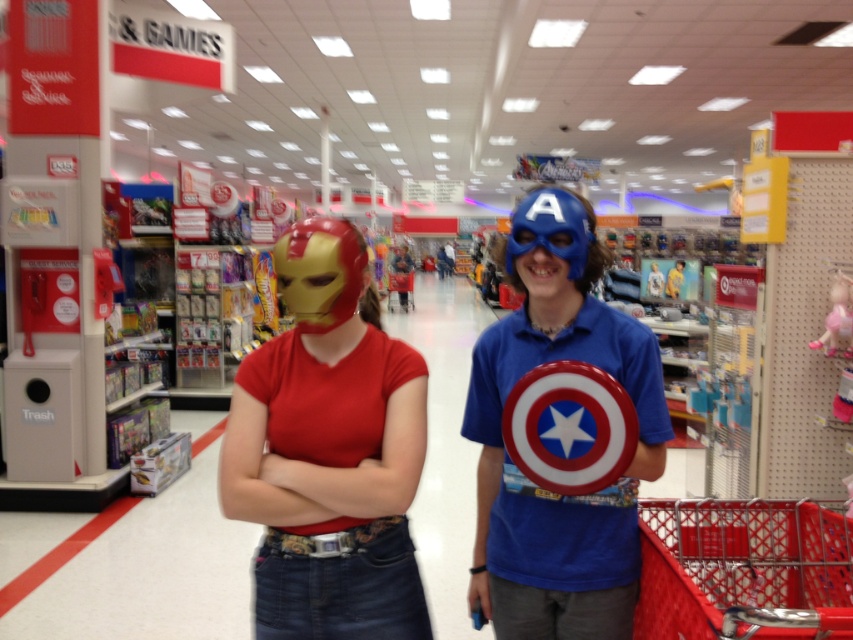
You are a customer in the Games section of Target, and you see two items displayed at the center of the store. The items are the shiny metallic mask at center and the shiny plastic shield at center. Which item is positioned closer to you?

The shiny metallic mask at center is closer to the viewer than the shiny plastic shield at center.

You are a customer in the Target Games section and want to take a photo of both the point at (260, 563) and the point at (485, 368). Which point should you focus on first to ensure both are in focus?

You should focus on point (485, 368) first because it is farther from the camera than point (260, 563). By focusing on the farther point, the closer point will also be within the depth of field, ensuring both are in focus.

You are a customer in the Games section of Target. You see a shiny metallic mask at center. Where exactly is it located in the store?

The shiny metallic mask at center is located at point coordinates of (560, 499).